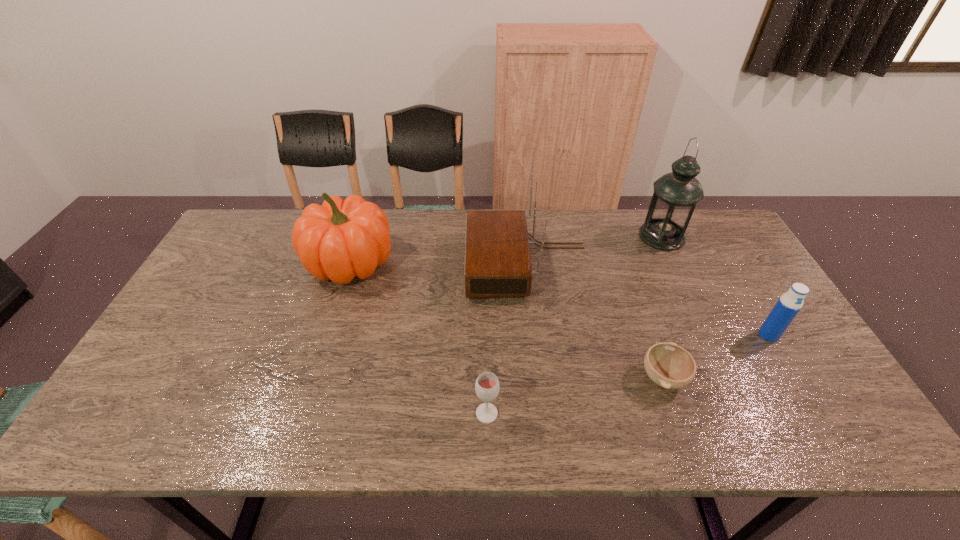
Identify the location of radio_receiver that is at the far edge. This screenshot has width=960, height=540. (497, 256).

Locate an element on the screen. The width and height of the screenshot is (960, 540). pumpkin that is positioned at the far edge is located at coordinates (339, 240).

Locate an element on the screen. The image size is (960, 540). object that is at the near edge is located at coordinates (487, 384).

Identify the location of oil lamp located at the right edge. (676, 194).

Where is `water bottle at the right edge`? The width and height of the screenshot is (960, 540). water bottle at the right edge is located at coordinates (789, 304).

Where is `object positioned at the far right corner`? This screenshot has width=960, height=540. object positioned at the far right corner is located at coordinates [676, 194].

I want to click on free space at the far edge, so click(635, 249).

Identify the location of free point at the near edge. Image resolution: width=960 pixels, height=540 pixels. (759, 424).

At what (x,y) coordinates should I click in order to perform the action: click on vacant region at the right edge of the desktop. Please return your answer as a coordinate pair (x, y). This screenshot has width=960, height=540. Looking at the image, I should click on (789, 359).

In the image, there is a desktop. What are the coordinates of `vacant space at the far left corner` in the screenshot? It's located at point(268,221).